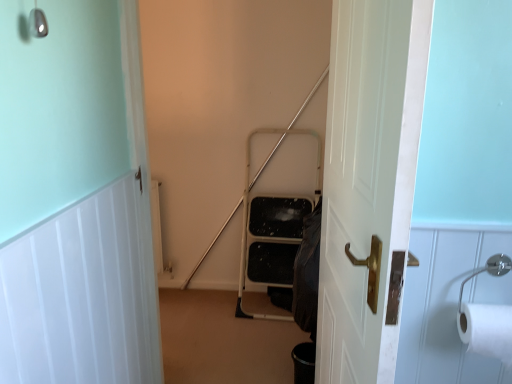
What is the approximate width of white wood door at upper left, the 2th door when ordered from right to left?

white wood door at upper left, the 2th door when ordered from right to left, is 2.27 inches in width.

Identify the location of white paper at right. (487, 330).

Where is `white wooden door at center, which ranks as the second door in left-to-right order`? The height and width of the screenshot is (384, 512). white wooden door at center, which ranks as the second door in left-to-right order is located at coordinates (368, 177).

From a real-world perspective, is white paper at right above or below white wooden door at center, marked as the first door in a right-to-left arrangement?

From a real-world perspective, white paper at right is physically below white wooden door at center, marked as the first door in a right-to-left arrangement.

Considering the points (490, 325) and (397, 319), which point is behind, point (490, 325) or point (397, 319)?

The point (490, 325) is more distant.

In terms of height, does white paper at right look taller or shorter compared to white wooden door at center, which ranks as the second door in left-to-right order?

Considering their sizes, white paper at right has less height than white wooden door at center, which ranks as the second door in left-to-right order.

Based on their positions, is white paper at right located to the left or right of white wooden door at center, marked as the first door in a right-to-left arrangement?

white paper at right is to the right of white wooden door at center, marked as the first door in a right-to-left arrangement.

From the image's perspective, which is above, white wood door at upper left, the 2th door when ordered from right to left, or white paper at right?

white paper at right appears higher in the image.

In the image, is white wood door at upper left, the 2th door when ordered from right to left, on the left side or the right side of white paper at right?

white wood door at upper left, the 2th door when ordered from right to left, is to the left of white paper at right.

Could you tell me if white wood door at upper left, which is the first door from left to right, is facing white paper at right?

Yes, white wood door at upper left, which is the first door from left to right, is aimed at white paper at right.

Is white paper at right shorter than white wood door at upper left, the 2th door when ordered from right to left?

Yes, white paper at right is shorter than white wood door at upper left, the 2th door when ordered from right to left.

What's the angular difference between white paper at right and white wood door at upper left, which is the first door from left to right,'s facing directions?

The angle between the facing direction of white paper at right and the facing direction of white wood door at upper left, which is the first door from left to right, is 88.8 degrees.

Does white paper at right have a smaller size compared to white wood door at upper left, the 2th door when ordered from right to left?

Correct, white paper at right occupies less space than white wood door at upper left, the 2th door when ordered from right to left.

Is white paper at right positioned with its back to white wood door at upper left, the 2th door when ordered from right to left?

That's not correct — white paper at right is not looking away from white wood door at upper left, the 2th door when ordered from right to left.

Considering the relative positions of white wooden door at center, marked as the first door in a right-to-left arrangement, and white wood door at upper left, the 2th door when ordered from right to left, in the image provided, is white wooden door at center, marked as the first door in a right-to-left arrangement, to the left of white wood door at upper left, the 2th door when ordered from right to left, from the viewer's perspective?

Incorrect, white wooden door at center, marked as the first door in a right-to-left arrangement, is not on the left side of white wood door at upper left, the 2th door when ordered from right to left.

Does white wooden door at center, which ranks as the second door in left-to-right order, come in front of white wood door at upper left, the 2th door when ordered from right to left?

Yes.

Between white wooden door at center, which ranks as the second door in left-to-right order, and white wood door at upper left, the 2th door when ordered from right to left, which one has larger size?

With larger size is white wooden door at center, which ranks as the second door in left-to-right order.

Could you measure the distance between white wooden door at center, marked as the first door in a right-to-left arrangement, and white wood door at upper left, the 2th door when ordered from right to left?

white wooden door at center, marked as the first door in a right-to-left arrangement, and white wood door at upper left, the 2th door when ordered from right to left, are 27.50 inches apart.

Is the position of white wooden door at center, which ranks as the second door in left-to-right order, more distant than that of white paper at right?

No, white wooden door at center, which ranks as the second door in left-to-right order, is closer to the camera.

How different are the orientations of white wooden door at center, marked as the first door in a right-to-left arrangement, and white paper at right in degrees?

The facing directions of white wooden door at center, marked as the first door in a right-to-left arrangement, and white paper at right are 83.5 degrees apart.

Is white wooden door at center, marked as the first door in a right-to-left arrangement, oriented away from white paper at right?

Yes, white wooden door at center, marked as the first door in a right-to-left arrangement,'s orientation is away from white paper at right.

How much distance is there between white wooden door at center, which ranks as the second door in left-to-right order, and white paper at right?

white wooden door at center, which ranks as the second door in left-to-right order, is 43.07 centimeters from white paper at right.

Is white wood door at upper left, the 2th door when ordered from right to left, wider or thinner than white wooden door at center, marked as the first door in a right-to-left arrangement?

Considering their sizes, white wood door at upper left, the 2th door when ordered from right to left, looks slimmer than white wooden door at center, marked as the first door in a right-to-left arrangement.

Which is more to the right, white wood door at upper left, the 2th door when ordered from right to left, or white wooden door at center, marked as the first door in a right-to-left arrangement?

Positioned to the right is white wooden door at center, marked as the first door in a right-to-left arrangement.

Considering the sizes of objects white wood door at upper left, the 2th door when ordered from right to left, and white wooden door at center, marked as the first door in a right-to-left arrangement, in the image provided, who is smaller, white wood door at upper left, the 2th door when ordered from right to left, or white wooden door at center, marked as the first door in a right-to-left arrangement,?

white wood door at upper left, the 2th door when ordered from right to left.

Is white wood door at upper left, which is the first door from left to right, not near white wooden door at center, which ranks as the second door in left-to-right order?

Actually, white wood door at upper left, which is the first door from left to right, and white wooden door at center, which ranks as the second door in left-to-right order, are a little close together.

The height and width of the screenshot is (384, 512). What are the coordinates of `toilet paper located behind the white wooden door at center, which ranks as the second door in left-to-right order` in the screenshot? It's located at coord(487,330).

Image resolution: width=512 pixels, height=384 pixels. I want to click on the 2nd door to the left of the white paper at right, starting your count from the anchor, so click(75, 200).

Considering their positions, is white wooden door at center, which ranks as the second door in left-to-right order, positioned further to white wood door at upper left, the 2th door when ordered from right to left, than white paper at right?

The object further to white wood door at upper left, the 2th door when ordered from right to left, is white paper at right.

Looking at the image, which one is located further to white paper at right, white wood door at upper left, which is the first door from left to right, or white wooden door at center, which ranks as the second door in left-to-right order?

Based on the image, white wood door at upper left, which is the first door from left to right, appears to be further to white paper at right.

When comparing their distances from white wooden door at center, marked as the first door in a right-to-left arrangement, does white wood door at upper left, the 2th door when ordered from right to left, or white paper at right seem closer?

Among the two, white paper at right is located nearer to white wooden door at center, marked as the first door in a right-to-left arrangement.

From the image, which object appears to be farther from white wooden door at center, which ranks as the second door in left-to-right order, white paper at right or white wood door at upper left, which is the first door from left to right?

white wood door at upper left, which is the first door from left to right.

Looking at the image, which one is located further to white paper at right, white wooden door at center, marked as the first door in a right-to-left arrangement, or white wood door at upper left, which is the first door from left to right?

white wood door at upper left, which is the first door from left to right, is positioned further to the anchor white paper at right.

Which object lies nearer to the anchor point white wood door at upper left, the 2th door when ordered from right to left, white paper at right or white wooden door at center, marked as the first door in a right-to-left arrangement?

white wooden door at center, marked as the first door in a right-to-left arrangement.

Find the location of `door between white wood door at upper left, the 2th door when ordered from right to left, and white paper at right`. door between white wood door at upper left, the 2th door when ordered from right to left, and white paper at right is located at coordinates (368, 177).